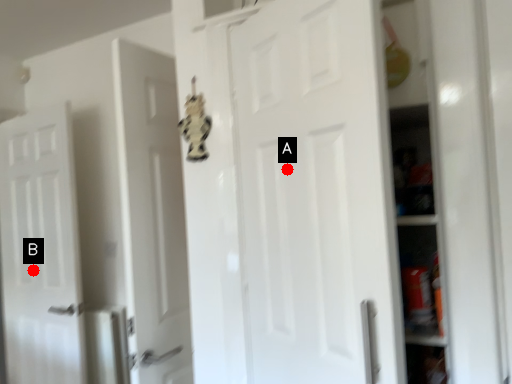
Question: Two points are circled on the image, labeled by A and B beside each circle. Which point is farther from the camera taking this photo?

Choices:
 (A) A is further
 (B) B is further

Answer: (B)